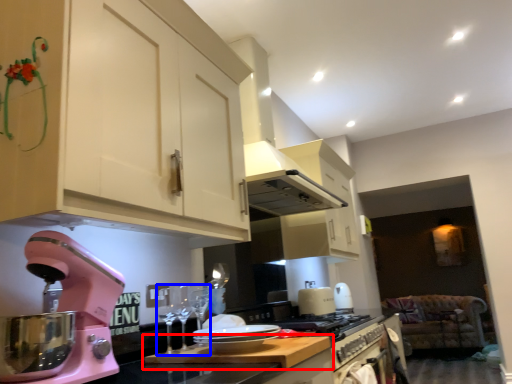
Question: Which object is closer to the camera taking this photo, countertop (highlighted by a red box) or wine glass (highlighted by a blue box)?

Choices:
 (A) countertop
 (B) wine glass

Answer: (A)